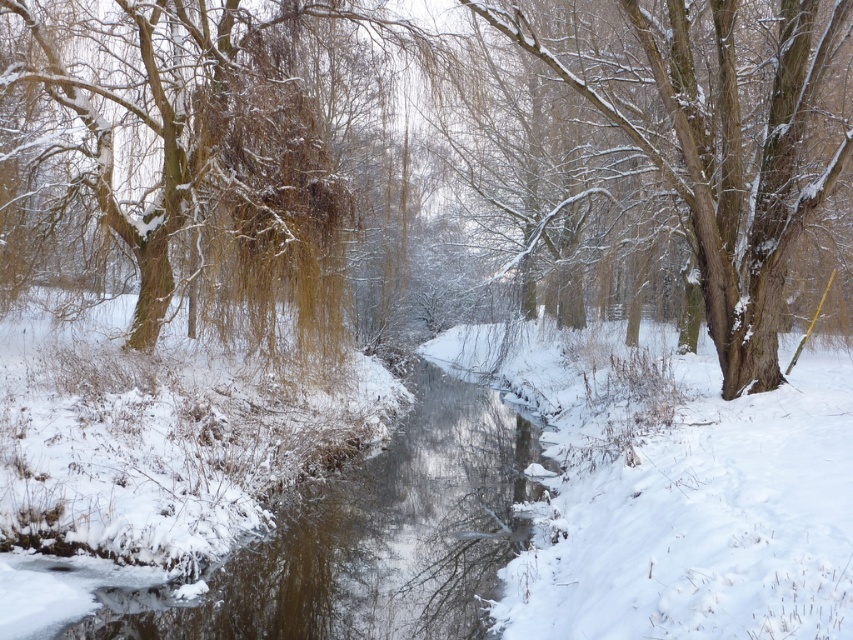
Question: Which of the following is the farthest from the observer?

Choices:
 (A) snow-covered bark tree at center
 (B) snow-covered willow at center
 (C) clear water at center

Answer: (B)

Question: Can you confirm if snow-covered willow at center is bigger than clear water at center?

Choices:
 (A) no
 (B) yes

Answer: (B)

Question: Does snow-covered willow at center appear under clear water at center?

Choices:
 (A) yes
 (B) no

Answer: (B)

Question: Which point is farther from the camera taking this photo?

Choices:
 (A) (273, 49)
 (B) (320, 616)

Answer: (A)

Question: Based on their relative distances, which object is farther from the clear water at center?

Choices:
 (A) snow-covered willow at center
 (B) snow-covered bark tree at center

Answer: (A)

Question: Is snow-covered willow at center positioned behind snow-covered bark tree at center?

Choices:
 (A) yes
 (B) no

Answer: (A)